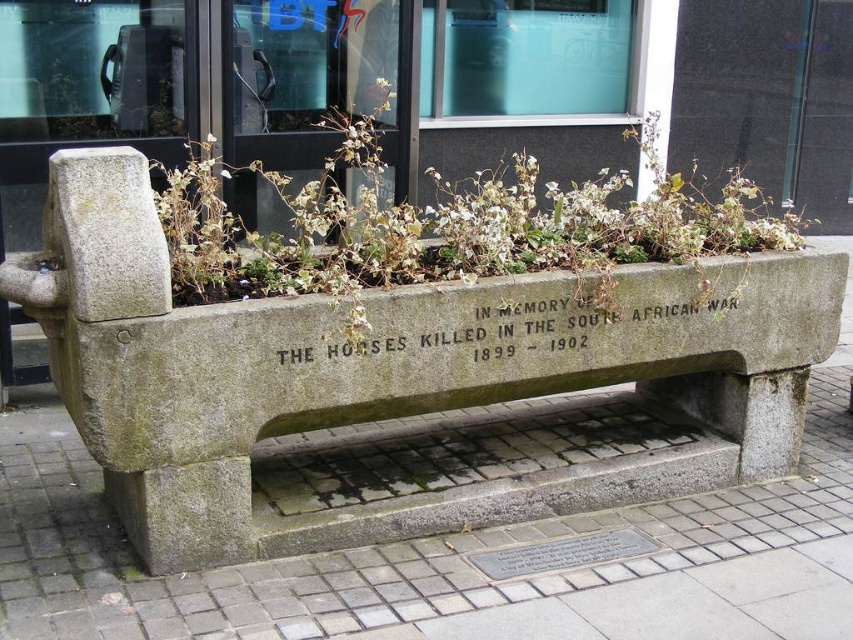
Question: Which object is positioned closest to the silver metallic plaque at lower center?

Choices:
 (A) black stone engraving at center
 (B) gray concrete bench at lower center

Answer: (B)

Question: Is gray stone bench at center wider than green leafy plant at center?

Choices:
 (A) yes
 (B) no

Answer: (A)

Question: Among these points, which one is farthest from the camera?

Choices:
 (A) (544, 560)
 (B) (158, 552)
 (C) (587, 340)

Answer: (C)

Question: Is gray stone bench at center thinner than green leafy plant at center?

Choices:
 (A) yes
 (B) no

Answer: (B)

Question: Can you confirm if black stone engraving at center is bigger than silver metallic plaque at lower center?

Choices:
 (A) yes
 (B) no

Answer: (A)

Question: Estimate the real-world distances between objects in this image. Which object is farther from the gray concrete bench at lower center?

Choices:
 (A) silver metallic plaque at lower center
 (B) gray stone bench at center
 (C) black stone engraving at center
 (D) green leafy plant at center

Answer: (D)